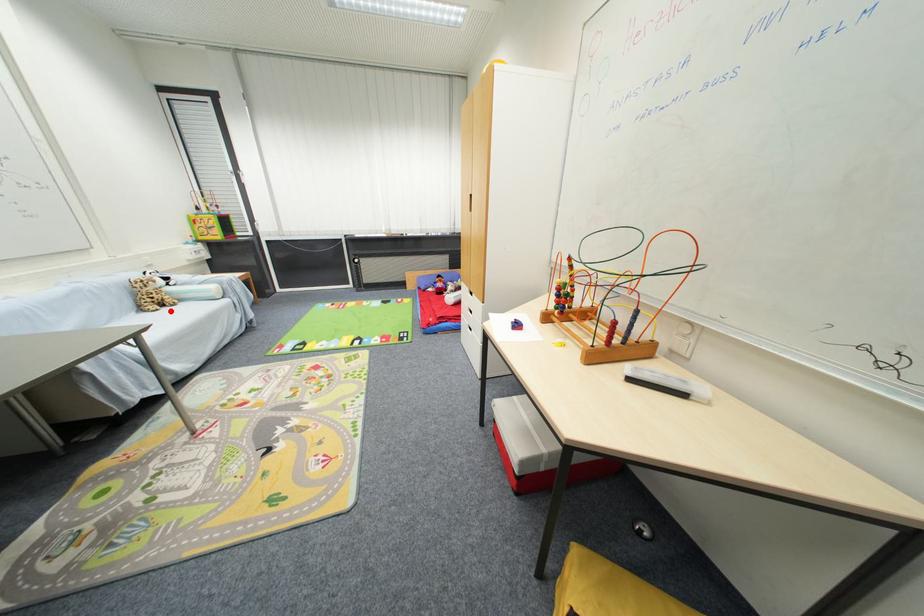
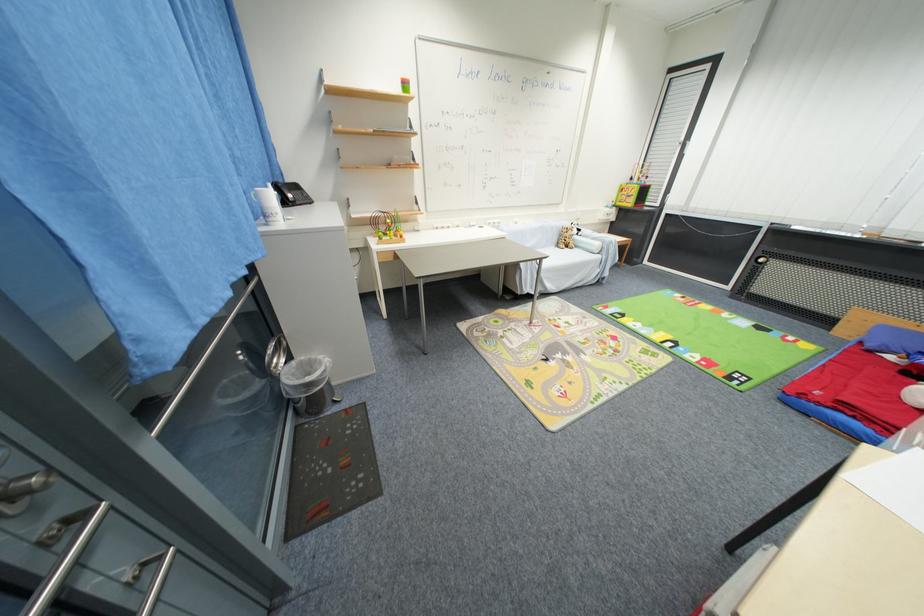
Question: I am providing you with two images of the same scene from different viewpoints. In image1, a red point is highlighted. Considering the same 3D point in image2, which of the following is correct?

Choices:
 (A) It is closer
 (B) It is farther

Answer: (B)